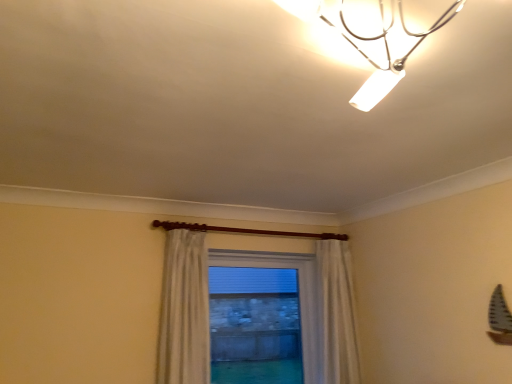
Question: Can you confirm if white sheer curtain at center is taller than metallic chrome lamp at upper center?

Choices:
 (A) yes
 (B) no

Answer: (A)

Question: Can you confirm if white sheer curtain at center is bigger than metallic chrome lamp at upper center?

Choices:
 (A) yes
 (B) no

Answer: (A)

Question: From the image's perspective, is white sheer curtain at center under metallic chrome lamp at upper center?

Choices:
 (A) yes
 (B) no

Answer: (A)

Question: Is white sheer curtain at center far away from metallic chrome lamp at upper center?

Choices:
 (A) no
 (B) yes

Answer: (B)

Question: Does white sheer curtain at center have a lesser height compared to metallic chrome lamp at upper center?

Choices:
 (A) no
 (B) yes

Answer: (A)

Question: From a real-world perspective, is metallic chrome lamp at upper center positioned above or below white sheer curtain at center?

Choices:
 (A) above
 (B) below

Answer: (A)

Question: Considering the positions of metallic chrome lamp at upper center and white sheer curtain at center in the image, is metallic chrome lamp at upper center bigger or smaller than white sheer curtain at center?

Choices:
 (A) big
 (B) small

Answer: (B)

Question: Considering the relative positions of metallic chrome lamp at upper center and white sheer curtain at center in the image provided, is metallic chrome lamp at upper center to the left or to the right of white sheer curtain at center?

Choices:
 (A) left
 (B) right

Answer: (B)

Question: Is metallic chrome lamp at upper center in front of or behind white sheer curtain at center in the image?

Choices:
 (A) behind
 (B) front

Answer: (B)

Question: From a real-world perspective, is clear glass window at center above or below white sheer curtain at center?

Choices:
 (A) below
 (B) above

Answer: (A)

Question: From the image's perspective, is clear glass window at center positioned above or below white sheer curtain at center?

Choices:
 (A) above
 (B) below

Answer: (B)

Question: Does point (296, 273) appear closer or farther from the camera than point (172, 339)?

Choices:
 (A) closer
 (B) farther

Answer: (B)

Question: Is clear glass window at center situated inside white sheer curtain at center or outside?

Choices:
 (A) inside
 (B) outside

Answer: (B)

Question: Considering the relative positions of clear glass window at center and metallic chrome lamp at upper center in the image provided, is clear glass window at center to the left or to the right of metallic chrome lamp at upper center?

Choices:
 (A) left
 (B) right

Answer: (A)

Question: From a real-world perspective, is clear glass window at center above or below metallic chrome lamp at upper center?

Choices:
 (A) below
 (B) above

Answer: (A)